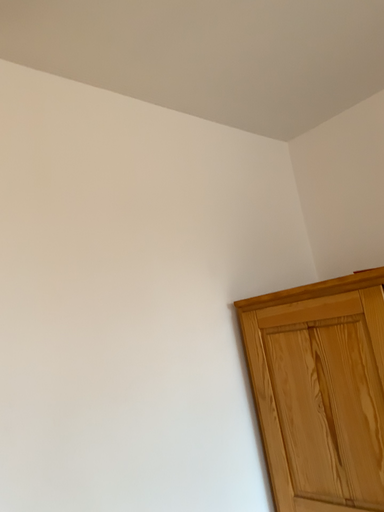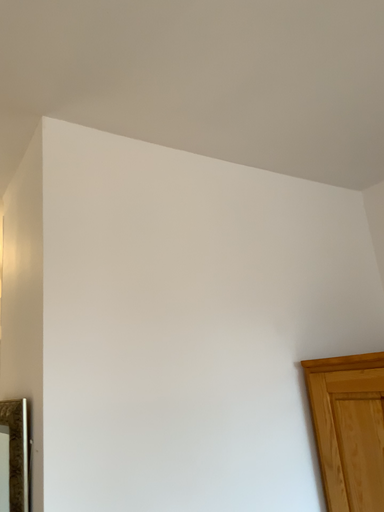
Question: Which way did the camera rotate in the video?

Choices:
 (A) rotated left
 (B) rotated right

Answer: (A)